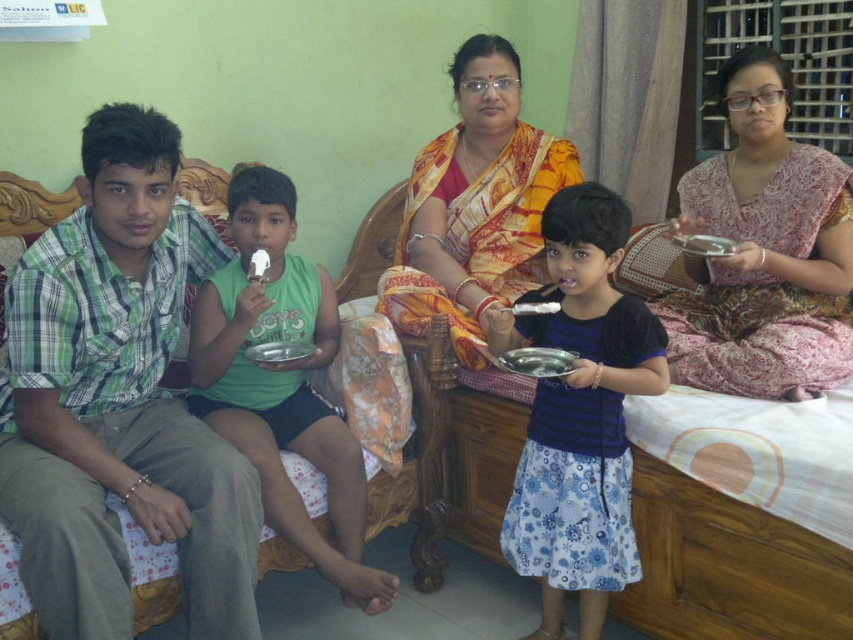
You are planning to place the silver metallic tray at center on top of the pink floral saree at upper right. Considering their sizes, will the tray fit entirely on the saree without hanging over the edges?

The pink floral saree at upper right is wider than the silver metallic tray at center, so the tray should fit entirely on the saree without overhanging the edges.

You are standing in the room and want to reach the point at coordinates (727, 266). If your arm can reach 1.8 meters, can you touch it without moving closer?

The point at coordinates (727, 266) is 2.20 meters away from the camera, so you cannot touch it with an arm reach of 1.8 meters without moving closer.